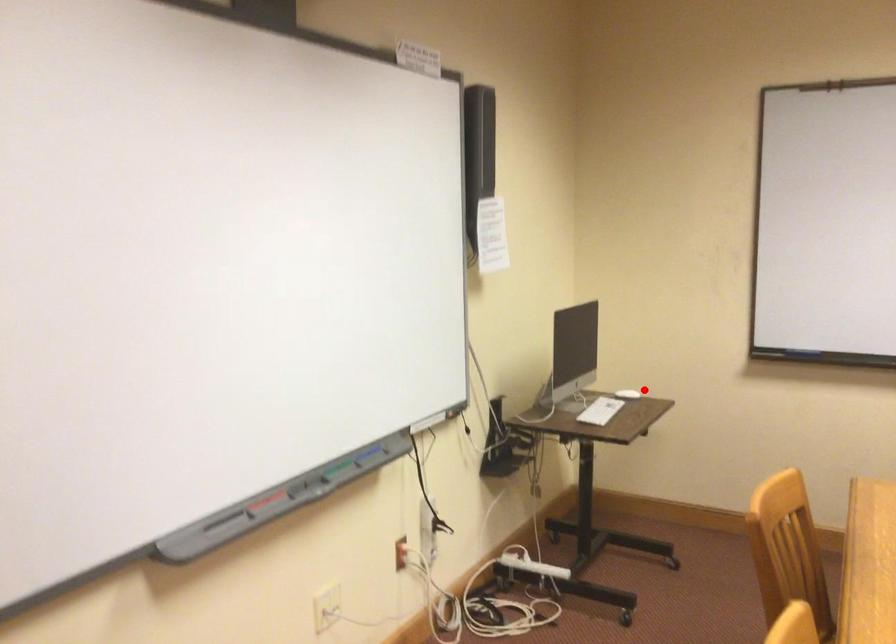
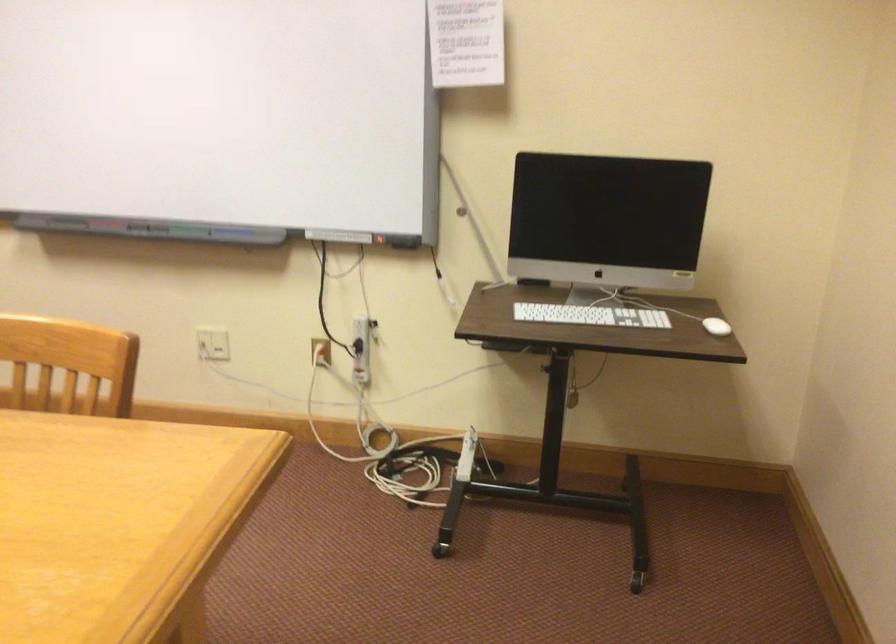
Question: A red point is marked in image1. In image2, is the corresponding 3D point closer to the camera or farther? Reply with the corresponding letter.

Choices:
 (A) The corresponding 3D point is closer.
 (B) The corresponding 3D point is farther.

Answer: (A)